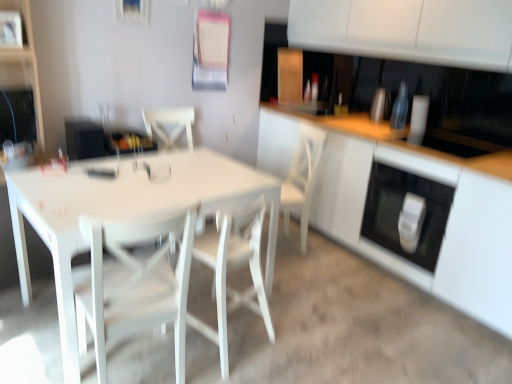
Measure the distance between white wood chair at center, acting as the 2th chair starting from the left, and camera.

6.01 feet.

Measure the distance between point (x=45, y=215) and camera.

Point (x=45, y=215) and camera are 1.79 meters apart.

Measure the distance between point (19, 2) and camera.

Point (19, 2) and camera are 8.06 feet apart.

What do you see at coordinates (302, 178) in the screenshot?
I see `white wood chair at center` at bounding box center [302, 178].

Identify the location of white glossy soap dispenser at lower right. (411, 222).

Describe the element at coordinates (411, 222) in the screenshot. The height and width of the screenshot is (384, 512). I see `white glossy soap dispenser at lower right` at that location.

In order to face white glossy oven at lower right, should I rotate leftwards or rightwards?

To face it directly, rotate right by 21.510 degrees.

This screenshot has height=384, width=512. What do you see at coordinates (401, 210) in the screenshot? I see `white glossy oven at lower right` at bounding box center [401, 210].

Identify the location of white wood chair at center, the 1th chair from the right. (233, 268).

Can we say white glossy table at center lies outside white glossy cabinet at center?

That's correct, white glossy table at center is outside of white glossy cabinet at center.

From the image's perspective, is white glossy table at center located above white glossy cabinet at center?

No.

Looking at the image, does white glossy table at center seem bigger or smaller compared to white glossy cabinet at center?

Clearly, white glossy table at center is smaller in size than white glossy cabinet at center.

Which is behind, white glossy table at center or white glossy cabinet at center?

white glossy cabinet at center is more distant.

The width and height of the screenshot is (512, 384). I want to click on shelf on the left of white glossy oven at lower right, so click(x=23, y=32).

Does white glossy oven at lower right appear on the left side of white glossy shelf at upper left?

No.

Looking at this image, from the image's perspective, which object appears higher, white glossy oven at lower right or white glossy shelf at upper left?

From the image's view, white glossy shelf at upper left is above.

Considering the relative sizes of white glossy oven at lower right and white glossy shelf at upper left in the image provided, is white glossy oven at lower right bigger than white glossy shelf at upper left?

Yes, white glossy oven at lower right is bigger than white glossy shelf at upper left.

Is white matte chair at center, the second chair positioned from the right, at the back of white glossy cabinet at center?

No.

What's the angular difference between white glossy cabinet at center and white matte chair at center, the second chair positioned from the right,'s facing directions?

There is a 97.9-degree angle between the facing directions of white glossy cabinet at center and white matte chair at center, the second chair positioned from the right.

From the image's perspective, is white glossy cabinet at center located beneath white matte chair at center, arranged as the first chair when viewed from the left?

Actually, white glossy cabinet at center appears above white matte chair at center, arranged as the first chair when viewed from the left, in the image.

Locate an element on the screen. Image resolution: width=512 pixels, height=384 pixels. cabinetry above the white matte chair at center, arranged as the first chair when viewed from the left (from a real-world perspective) is located at coordinates (446, 227).

From the image's perspective, is white glossy oven at lower right under white glossy table at center?

No, from the image's perspective, white glossy oven at lower right is not below white glossy table at center.

From a real-world perspective, is white glossy oven at lower right positioned over white glossy table at center based on gravity?

Yes, from a real-world perspective, white glossy oven at lower right is over white glossy table at center

Measure the distance between white glossy oven at lower right and white glossy table at center.

4.24 feet.

Consider the image. Does white glossy oven at lower right appear on the left side of white glossy table at center?

No, white glossy oven at lower right is not to the left of white glossy table at center.

Considering the positions of objects white matte chair at center, the second chair positioned from the right, and white wood chair at center in the image provided, who is more to the left, white matte chair at center, the second chair positioned from the right, or white wood chair at center?

Positioned to the left is white matte chair at center, the second chair positioned from the right.

From a real-world perspective, which object rests below the other?

white matte chair at center, the second chair positioned from the right, from a real-world perspective.

How distant is white matte chair at center, the second chair positioned from the right, from white wood chair at center?

The distance of white matte chair at center, the second chair positioned from the right, from white wood chair at center is 4.23 feet.

Based on the photo, which object is wider, white matte chair at center, arranged as the first chair when viewed from the left, or white wood chair at center?

With larger width is white wood chair at center.

From the image's perspective, is white glossy oven at lower right above white glossy cabinet at center?

No.

From their relative heights in the image, would you say white glossy oven at lower right is taller or shorter than white glossy cabinet at center?

In the image, white glossy oven at lower right appears to be shorter than white glossy cabinet at center.

Is white glossy oven at lower right looking in the opposite direction of white glossy cabinet at center?

Yes, white glossy cabinet at center is at the back of white glossy oven at lower right.

Which is more to the left, white glossy oven at lower right or white glossy cabinet at center?

white glossy cabinet at center.

Is white glossy table at center to the left of white wood chair at center, acting as the 2th chair starting from the left, from the viewer's perspective?

Yes, white glossy table at center is to the left of white wood chair at center, acting as the 2th chair starting from the left.

Does point (44, 233) come in front of point (265, 319)?

Yes.

Is white glossy table at center turned away from white wood chair at center, acting as the 2th chair starting from the left?

Yes.

At what (x,y) coordinates should I click in order to perform the action: click on table on the left of white glossy cabinet at center. Please return your answer as a coordinate pair (x, y). Looking at the image, I should click on (124, 215).

Find the location of a particular element. The image size is (512, 384). oven behind the white glossy shelf at upper left is located at coordinates (401, 210).

Estimate the real-world distances between objects in this image. Which object is further from white glossy cabinet at center, white wood chair at center or white matte chair at center, the second chair positioned from the right?

The object further to white glossy cabinet at center is white matte chair at center, the second chair positioned from the right.

In the scene shown: From the image, which object appears to be farther from white wood chair at center, the 1th chair from the right, white matte chair at center, the second chair positioned from the right, or white glossy table at center?

white glossy table at center lies further to white wood chair at center, the 1th chair from the right, than the other object.

Based on their spatial positions, is white glossy soap dispenser at lower right or white wood chair at center, the 1th chair from the right, further from white glossy shelf at upper left?

white glossy soap dispenser at lower right is positioned further to the anchor white glossy shelf at upper left.

Looking at the image, which one is located closer to white glossy table at center, white glossy cabinet at center or white glossy soap dispenser at lower right?

white glossy cabinet at center.

Considering their positions, is white glossy shelf at upper left positioned further to white glossy cabinet at center than white glossy table at center?

Based on the image, white glossy shelf at upper left appears to be further to white glossy cabinet at center.

From the image, which object appears to be farther from white glossy shelf at upper left, white wood chair at center, the 1th chair from the right, or white glossy soap dispenser at lower right?

The object further to white glossy shelf at upper left is white glossy soap dispenser at lower right.

When comparing their distances from white glossy cabinet at center, does white glossy soap dispenser at lower right or white wood chair at center seem further?

Among the two, white wood chair at center is located further to white glossy cabinet at center.

Which object lies nearer to the anchor point white matte chair at center, arranged as the first chair when viewed from the left, white glossy soap dispenser at lower right or white wood chair at center?

Among the two, white wood chair at center is located nearer to white matte chair at center, arranged as the first chair when viewed from the left.

Identify the location of chair between white glossy table at center and white wood chair at center from front to back. (233, 268).

This screenshot has width=512, height=384. Find the location of `chair between white matte chair at center, the second chair positioned from the right, and white glossy cabinet at center from left to right`. chair between white matte chair at center, the second chair positioned from the right, and white glossy cabinet at center from left to right is located at coordinates (233, 268).

The image size is (512, 384). I want to click on armchair between white glossy table at center and white glossy oven at lower right, so pos(302,178).

The width and height of the screenshot is (512, 384). I want to click on cabinetry between white glossy shelf at upper left and white glossy oven at lower right in the horizontal direction, so click(446, 227).